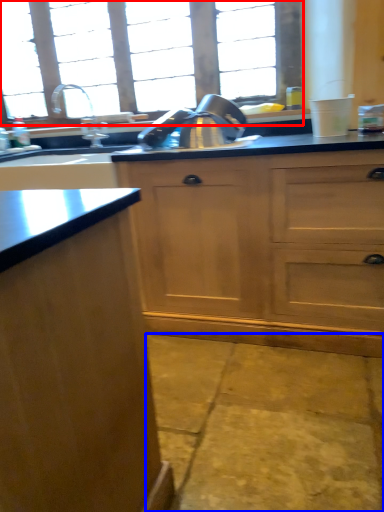
Question: Which object is further to the camera taking this photo, window (highlighted by a red box) or concrete (highlighted by a blue box)?

Choices:
 (A) window
 (B) concrete

Answer: (A)